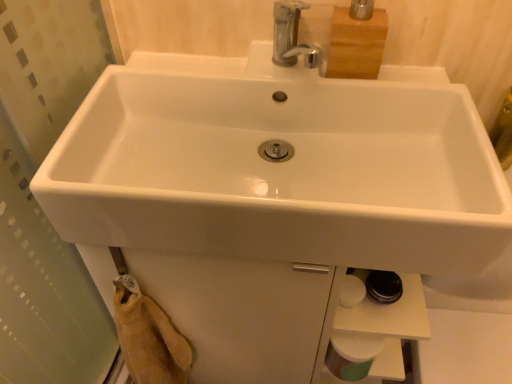
Question: Does white matte toilet paper at lower right appear on the right side of white glossy sink at center?

Choices:
 (A) no
 (B) yes

Answer: (B)

Question: Is white matte toilet paper at lower right in contact with white glossy sink at center?

Choices:
 (A) yes
 (B) no

Answer: (B)

Question: Does white matte toilet paper at lower right have a larger size compared to white glossy sink at center?

Choices:
 (A) yes
 (B) no

Answer: (B)

Question: From the image's perspective, is white matte toilet paper at lower right under white glossy sink at center?

Choices:
 (A) no
 (B) yes

Answer: (B)

Question: Does white matte toilet paper at lower right have a lesser height compared to white glossy sink at center?

Choices:
 (A) yes
 (B) no

Answer: (A)

Question: Is white matte toilet paper at lower right taller than white glossy sink at center?

Choices:
 (A) no
 (B) yes

Answer: (A)

Question: Is white glossy sink at center not near white matte toilet paper at lower right?

Choices:
 (A) yes
 (B) no

Answer: (B)

Question: From a real-world perspective, is white glossy sink at center under white matte toilet paper at lower right?

Choices:
 (A) no
 (B) yes

Answer: (A)

Question: Is white glossy sink at center at the left side of white matte toilet paper at lower right?

Choices:
 (A) no
 (B) yes

Answer: (B)

Question: Does white glossy sink at center come in front of white matte toilet paper at lower right?

Choices:
 (A) no
 (B) yes

Answer: (B)

Question: From the image's perspective, would you say white glossy sink at center is positioned over white matte toilet paper at lower right?

Choices:
 (A) no
 (B) yes

Answer: (B)

Question: From a real-world perspective, is white glossy sink at center physically above white matte toilet paper at lower right?

Choices:
 (A) no
 (B) yes

Answer: (B)

Question: Does point (337, 364) appear closer or farther from the camera than point (313, 89)?

Choices:
 (A) closer
 (B) farther

Answer: (B)